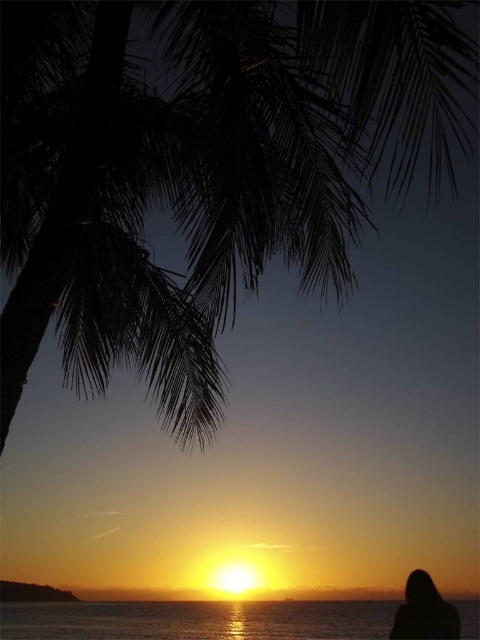
You are standing on the beach and see the shiny silver water at lower center and the black matte hair at lower right. Which object is located lower in the scene?

The shiny silver water at lower center is located below the black matte hair at lower right, so it is lower in the scene.

You are standing at the center of the beach looking towards the sunset. There is a point marked at coordinates [204,168]. What object is located at that point?

The silhouette leafy palm at upper left is located at point [204,168].